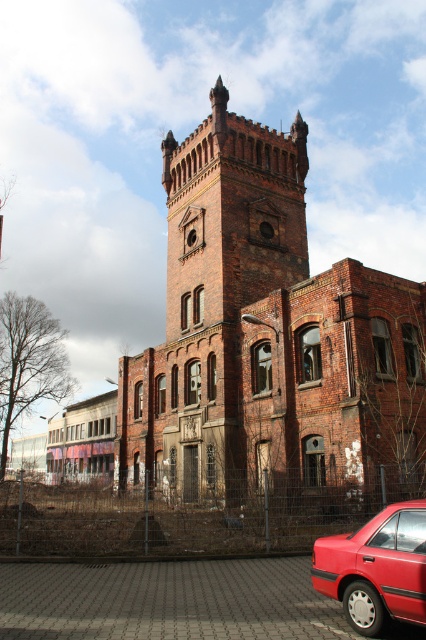
You are a delivery driver who needs to park your shiny red sedan at lower right closer to the brown brick tower at center. Given that the tower is larger than the car, can you estimate how much space you need to leave between your car and the tower to ensure safety?

The brown brick tower at center is larger in size than the shiny red sedan at lower right, so you should leave at least 2 meters of space between the car and the tower to ensure safety.